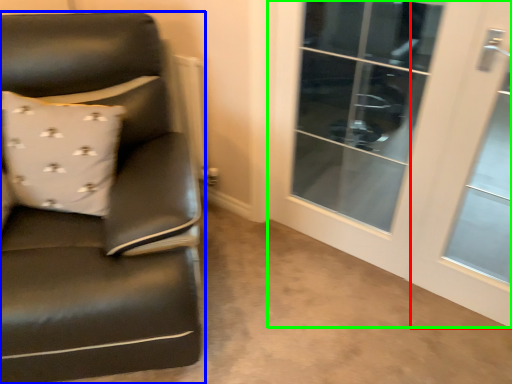
Question: Which object is the farthest from screen door (highlighted by a red box)? Choose among these: chair (highlighted by a blue box) or screen door (highlighted by a green box).

Choices:
 (A) chair
 (B) screen door

Answer: (A)